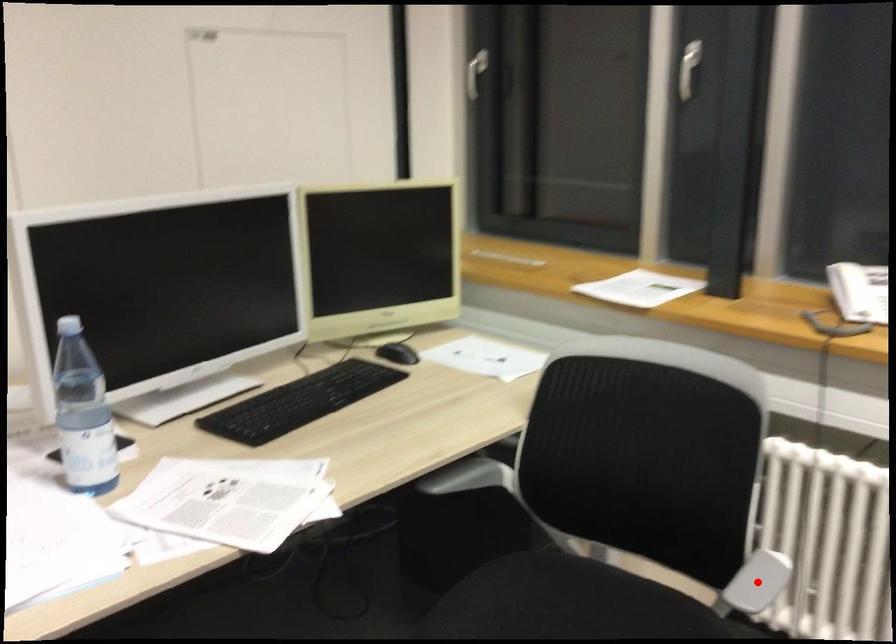
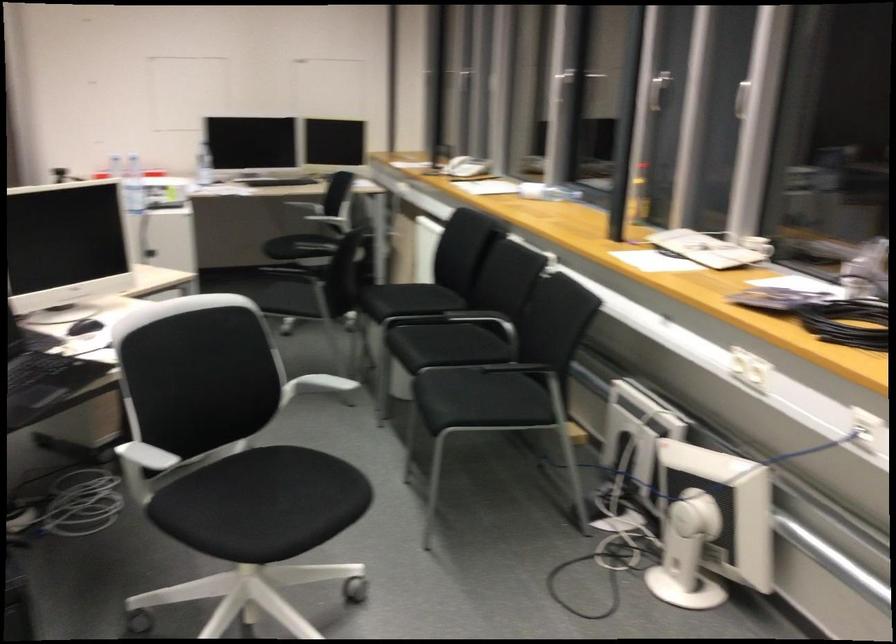
Question: I am providing you with two images of the same scene from different viewpoints. Image1 has a red point marked. In image2, the corresponding 3D location appears at what relative position? Reply with the corresponding letter.

Choices:
 (A) Closer
 (B) Farther

Answer: (B)